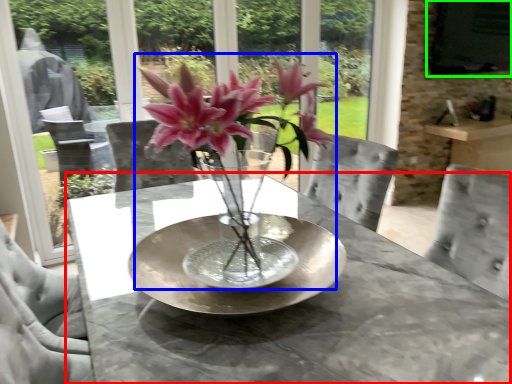
Question: Which object is the farthest from table (highlighted by a red box)? Choose among these: houseplant (highlighted by a blue box) or window screen (highlighted by a green box).

Choices:
 (A) houseplant
 (B) window screen

Answer: (B)